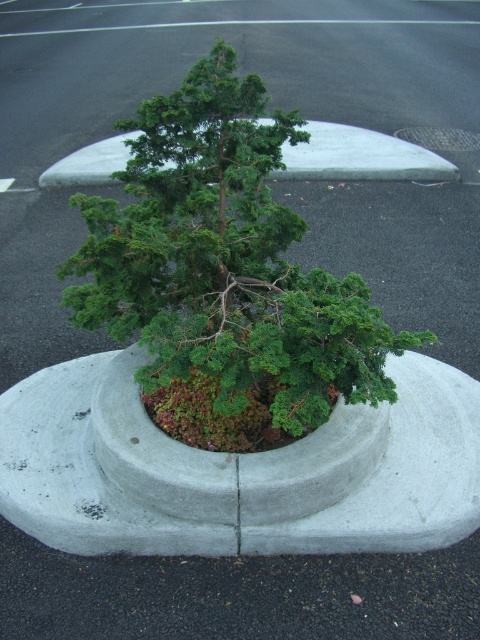
Which is in front, point (266, 243) or point (423, 531)?

Point (423, 531)

Find the location of a particular element. This screenshot has height=640, width=480. green matte tree at center is located at coordinates [224, 275].

At what (x,y) coordinates should I click in order to perform the action: click on green matte tree at center. Please return your answer as a coordinate pair (x, y). Looking at the image, I should click on (224, 275).

Find the location of a particular element. green matte tree at center is located at coordinates (224, 275).

Which of these two, green matte tree at center or concrete at center, stands shorter?

With less height is concrete at center.

Can you confirm if green matte tree at center is positioned above concrete at center?

No.

Describe the element at coordinates (224, 275) in the screenshot. This screenshot has height=640, width=480. I see `green matte tree at center` at that location.

This screenshot has width=480, height=640. I want to click on green matte tree at center, so click(x=224, y=275).

Based on the photo, can you confirm if gray concrete planter at center is smaller than concrete at center?

Indeed, gray concrete planter at center has a smaller size compared to concrete at center.

Can you confirm if gray concrete planter at center is thinner than concrete at center?

In fact, gray concrete planter at center might be wider than concrete at center.

This screenshot has height=640, width=480. In order to click on gray concrete planter at center in this screenshot , I will do `click(238, 468)`.

Identify the location of gray concrete planter at center. (238, 468).